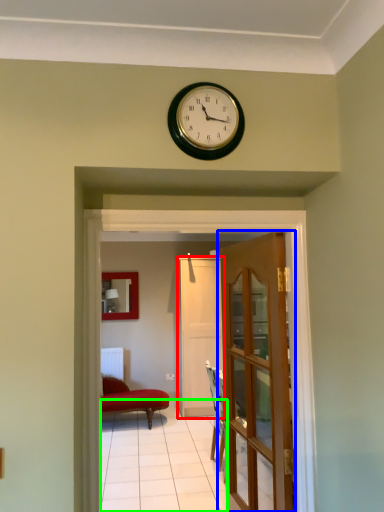
Question: Which object is the closest to the door (highlighted by a red box)? Choose among these: door (highlighted by a blue box) or path (highlighted by a green box).

Choices:
 (A) door
 (B) path

Answer: (B)